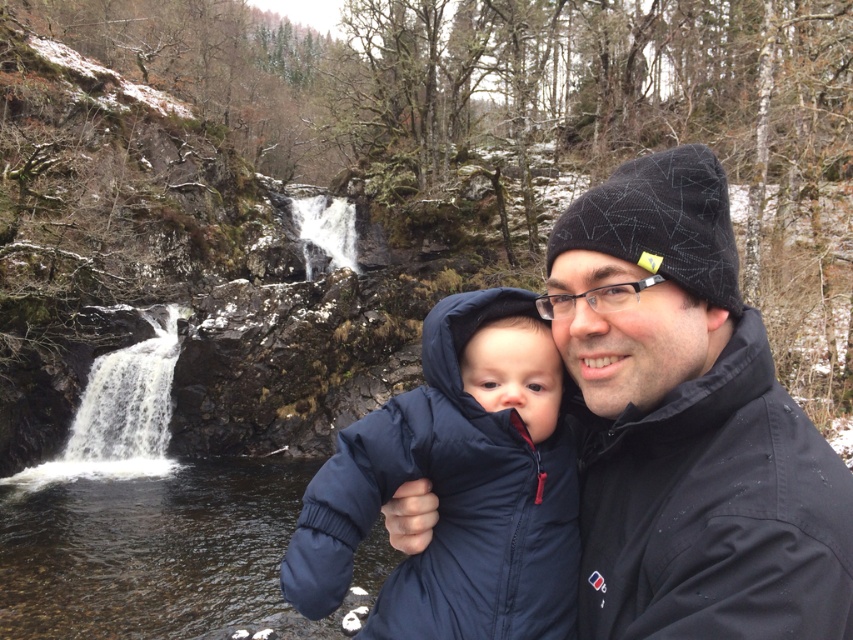
You are a photographer trying to capture the two jackets in the scene. According to the image, which jacket is positioned lower in the frame between the navy puffy jacket at center and the navy blue puffer jacket at center?

The navy puffy jacket at center is positioned lower in the frame than the navy blue puffer jacket at center.

You are a photographer trying to capture both the black matte jacket at right and the navy blue puffer jacket at center in a single shot. Which jacket should you focus on first to ensure both are in the frame?

You should focus on the navy blue puffer jacket at center first because the black matte jacket at right is in front of it, so focusing on the navy blue puffer jacket at center will keep both in focus.